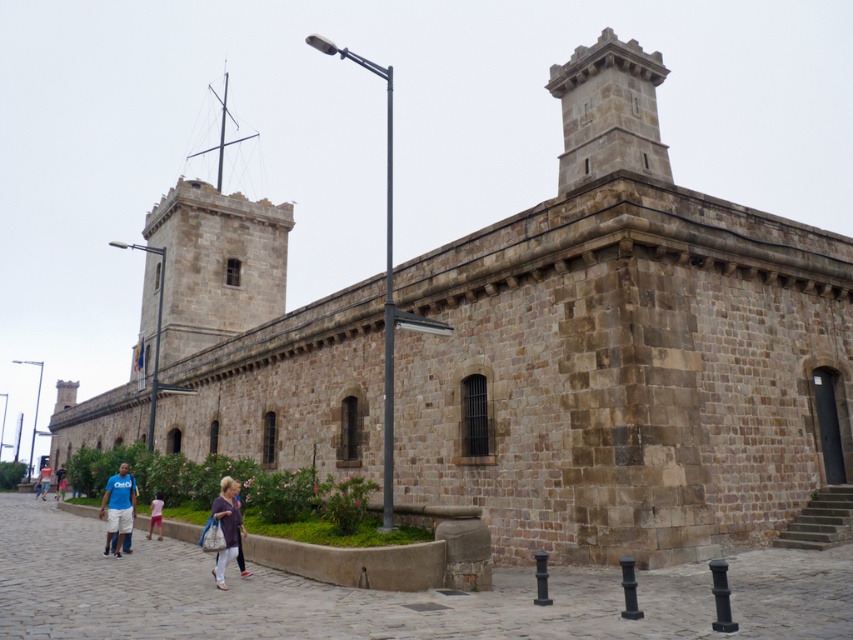
You are a tour guide explaining the historic stone building to visitors. You notice a matte purple shirt at center and a light blue denim shorts at lower left in the image. Which clothing item is positioned higher relative to the building?

The matte purple shirt at center is positioned higher than the light blue denim shorts at lower left because it is located above it.